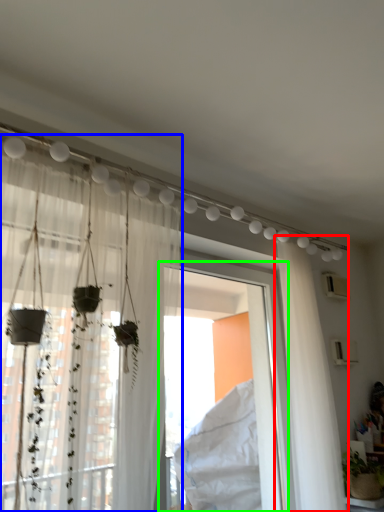
Question: Which object is positioned farthest from curtain (highlighted by a red box)? Select from curtain (highlighted by a blue box) and window frame (highlighted by a green box).

Choices:
 (A) curtain
 (B) window frame

Answer: (A)